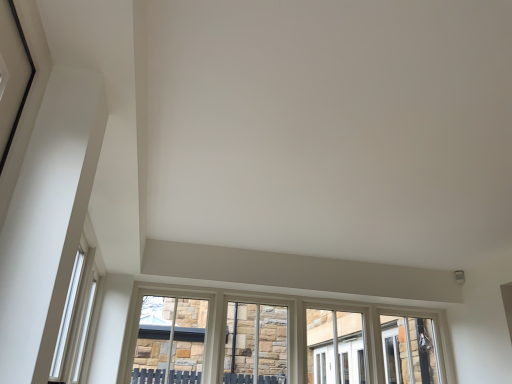
What is the approximate height of white textured window at center?

The height of white textured window at center is 27.34 inches.

What do you see at coordinates (276, 341) in the screenshot?
I see `white textured window at center` at bounding box center [276, 341].

Measure the distance between point (318, 349) and camera.

Point (318, 349) and camera are 3.21 meters apart.

Find the location of `white textured window at center`. white textured window at center is located at coordinates (276, 341).

Locate an element on the screen. The image size is (512, 384). white textured window at center is located at coordinates (276, 341).